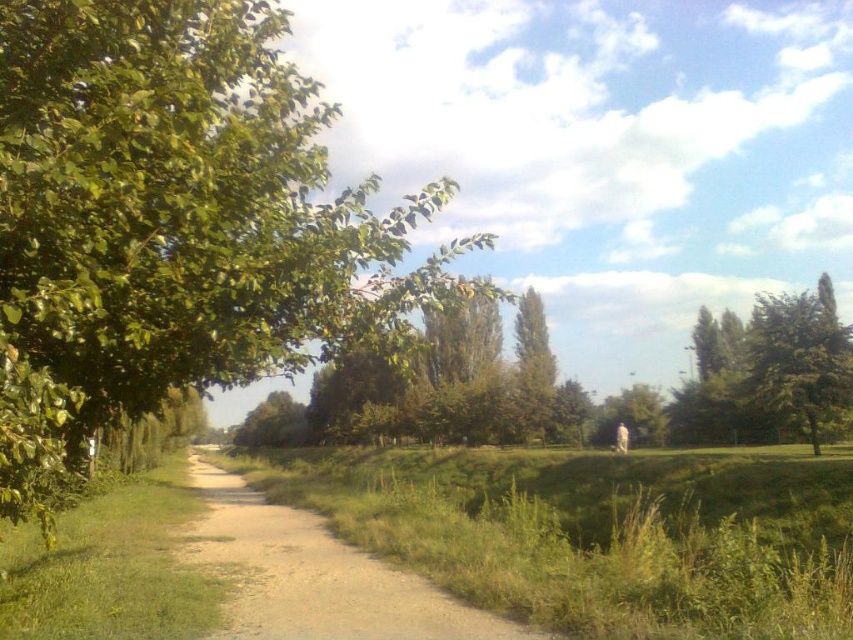
Question: Can you confirm if green grass at lower center is wider than dirt/gravel path at center?

Choices:
 (A) yes
 (B) no

Answer: (A)

Question: Which of the following is the farthest from the observer?

Choices:
 (A) (767, 554)
 (B) (514, 621)
 (C) (846, 348)

Answer: (C)

Question: Does green grass at lower center lie in front of dirt/gravel path at center?

Choices:
 (A) no
 (B) yes

Answer: (B)

Question: Which of the following is the closest to the observer?

Choices:
 (A) (437, 572)
 (B) (799, 404)

Answer: (A)

Question: Is the position of green leafy tree at left less distant than that of green grass at lower center?

Choices:
 (A) yes
 (B) no

Answer: (A)

Question: Which point is farther from the camera taking this photo?

Choices:
 (A) (242, 380)
 (B) (785, 339)
 (C) (386, 593)

Answer: (B)